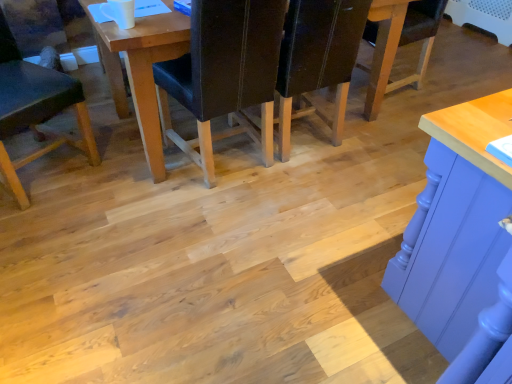
Find the location of a particular element. Image resolution: width=512 pixels, height=384 pixels. space that is in front of dark brown leather chair at center, which is the first chair from right to left is located at coordinates (323, 200).